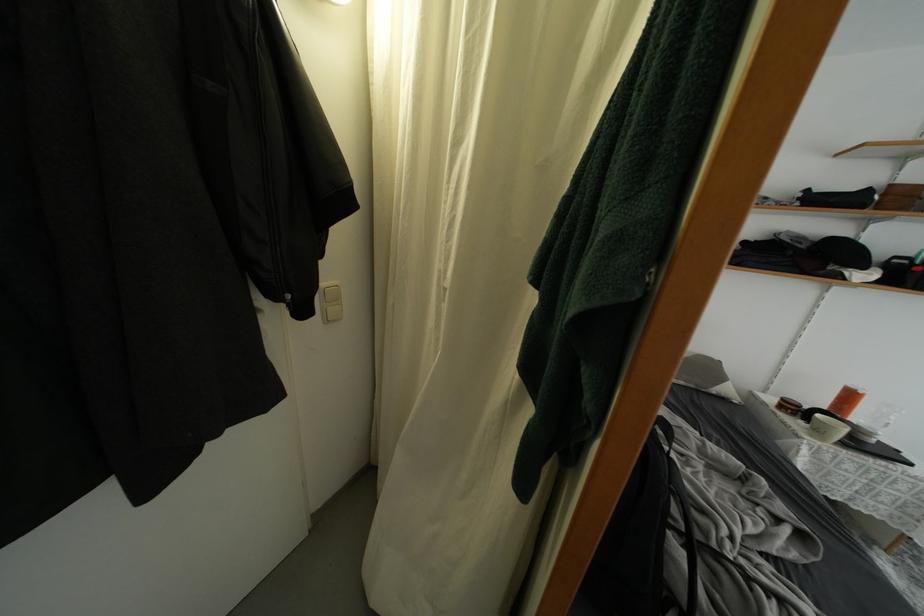
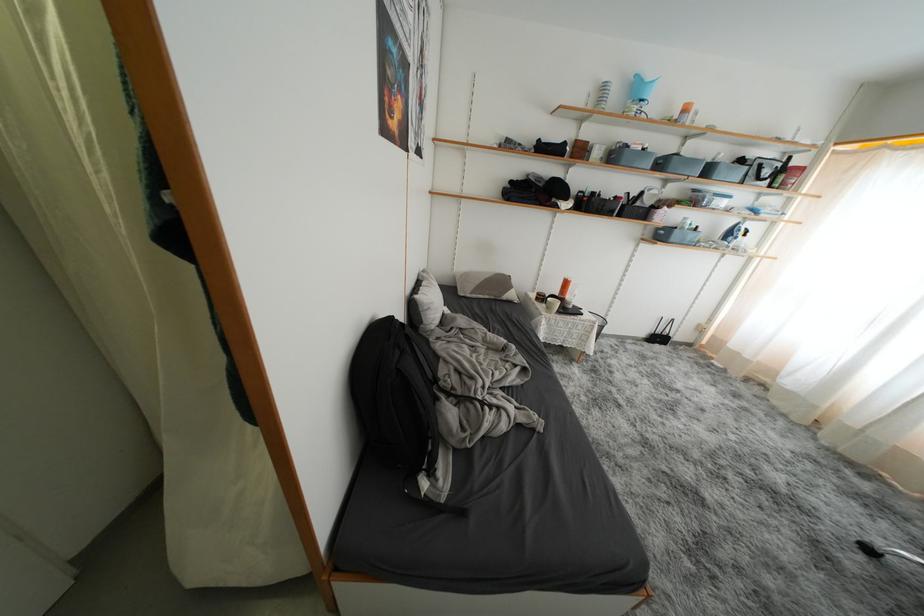
Question: The camera is either moving clockwise (left) or counter-clockwise (right) around the object. The first image is from the beginning of the video and the second image is from the end. Is the camera moving left or right when shooting the video?

Choices:
 (A) Left
 (B) Right

Answer: (A)